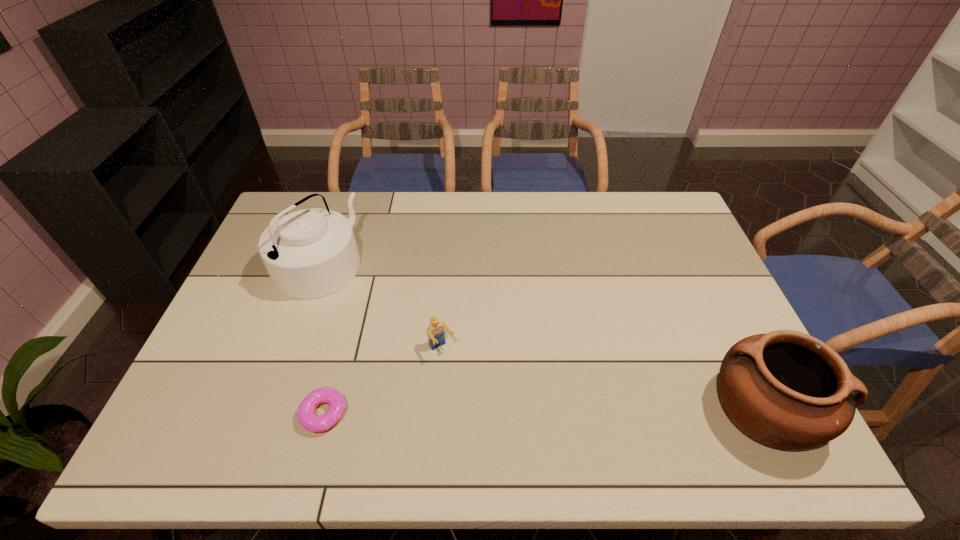
Identify the location of the shortest object. This screenshot has width=960, height=540. (306, 416).

Identify the location of the rightmost object. (785, 389).

You are a GUI agent. You are given a task and a screenshot of the screen. Output one action in this format:
    pyautogui.click(x=<x>, y=<y>)
    Task: Click on the pottery
    
    Given the screenshot: What is the action you would take?
    (x=785, y=389)

The width and height of the screenshot is (960, 540). Identify the location of the farthest object. (310, 253).

Locate an element on the screen. The width and height of the screenshot is (960, 540). kettle is located at coordinates (310, 253).

Locate an element on the screen. the second shortest object is located at coordinates (436, 335).

Identify the location of the second object from right to left. The height and width of the screenshot is (540, 960). pyautogui.click(x=436, y=335).

I want to click on vacant position located on the left of the doughnut, so click(x=179, y=413).

Find the location of a particular element. vacant position located on the back of the pottery is located at coordinates (709, 298).

Where is `vacant space located on the spout of the tallest object`? The width and height of the screenshot is (960, 540). vacant space located on the spout of the tallest object is located at coordinates (437, 339).